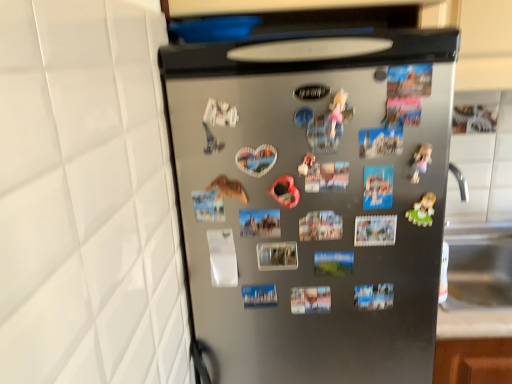
What is the approximate width of plastic green toy at right?

plastic green toy at right is 2.44 centimeters in width.

Locate an element on the screen. Image resolution: width=512 pixels, height=384 pixels. plastic green toy at right is located at coordinates (422, 210).

This screenshot has height=384, width=512. What do you see at coordinates (422, 210) in the screenshot?
I see `plastic green toy at right` at bounding box center [422, 210].

What do you see at coordinates (312, 202) in the screenshot? I see `satin silver refrigerator at center` at bounding box center [312, 202].

The width and height of the screenshot is (512, 384). I want to click on satin silver refrigerator at center, so coord(312,202).

What is the approximate width of satin silver refrigerator at center?

satin silver refrigerator at center is 66.02 centimeters in width.

Identify the location of plastic green toy at right. (422, 210).

Which is more to the left, plastic green toy at right or satin silver refrigerator at center?

From the viewer's perspective, satin silver refrigerator at center appears more on the left side.

Is plastic green toy at right in front of or behind satin silver refrigerator at center in the image?

Visually, plastic green toy at right is located behind satin silver refrigerator at center.

Which is closer to the camera, [430,194] or [417,382]?

Point [430,194].

From the image's perspective, which is above, plastic green toy at right or satin silver refrigerator at center?

plastic green toy at right.

From a real-world perspective, between plastic green toy at right and satin silver refrigerator at center, who is vertically higher?

plastic green toy at right is physically above.

In the scene shown: Which of these two, plastic green toy at right or satin silver refrigerator at center, is thinner?

With smaller width is plastic green toy at right.

Which of these two, plastic green toy at right or satin silver refrigerator at center, stands shorter?

plastic green toy at right.

Is plastic green toy at right bigger or smaller than satin silver refrigerator at center?

Considering their sizes, plastic green toy at right takes up less space than satin silver refrigerator at center.

From the picture: Is satin silver refrigerator at center completely or partially inside plastic green toy at right?

No, satin silver refrigerator at center is not a part of plastic green toy at right.

Looking at this image, is plastic green toy at right not near satin silver refrigerator at center?

That's not correct — plastic green toy at right is a little close to satin silver refrigerator at center.

Is plastic green toy at right positioned with its back to satin silver refrigerator at center?

Yes, satin silver refrigerator at center is at the back of plastic green toy at right.

At what (x,y) coordinates should I click in order to perform the action: click on toy located on the right of satin silver refrigerator at center. Please return your answer as a coordinate pair (x, y). The image size is (512, 384). Looking at the image, I should click on 422,210.

Considering the relative positions of satin silver refrigerator at center and plastic green toy at right in the image provided, is satin silver refrigerator at center to the left or to the right of plastic green toy at right?

From the image, it's evident that satin silver refrigerator at center is to the left of plastic green toy at right.

In the image, is satin silver refrigerator at center positioned in front of or behind plastic green toy at right?

satin silver refrigerator at center is positioned closer to the viewer than plastic green toy at right.

Considering the positions of point (314, 377) and point (420, 222), is point (314, 377) closer or farther from the camera than point (420, 222)?

Point (314, 377) appears to be farther away from the viewer than point (420, 222).

From the image's perspective, relative to plastic green toy at right, is satin silver refrigerator at center above or below?

From the image's perspective, satin silver refrigerator at center appears below plastic green toy at right.

From a real-world perspective, relative to plastic green toy at right, is satin silver refrigerator at center vertically above or below?

satin silver refrigerator at center is situated lower than plastic green toy at right in the real world.

Does satin silver refrigerator at center have a greater width compared to plastic green toy at right?

Yes.

Is satin silver refrigerator at center shorter than plastic green toy at right?

In fact, satin silver refrigerator at center may be taller than plastic green toy at right.

Considering the relative sizes of satin silver refrigerator at center and plastic green toy at right in the image provided, is satin silver refrigerator at center bigger than plastic green toy at right?

Yes.

Is satin silver refrigerator at center spatially inside plastic green toy at right, or outside of it?

satin silver refrigerator at center lies outside plastic green toy at right.

Is satin silver refrigerator at center not close to plastic green toy at right?

No.

Is plastic green toy at right at the back of satin silver refrigerator at center?

satin silver refrigerator at center does not have its back to plastic green toy at right.

How different are the orientations of satin silver refrigerator at center and plastic green toy at right in degrees?

2.85 degrees separate the facing orientations of satin silver refrigerator at center and plastic green toy at right.

How far apart are satin silver refrigerator at center and plastic green toy at right?

satin silver refrigerator at center and plastic green toy at right are 12.41 inches apart from each other.

Image resolution: width=512 pixels, height=384 pixels. I want to click on toy above the satin silver refrigerator at center (from a real-world perspective), so click(422, 210).

Identify the location of toy that is above the satin silver refrigerator at center (from the image's perspective). (422, 210).

The image size is (512, 384). I want to click on refrigerator lying in front of the plastic green toy at right, so click(x=312, y=202).